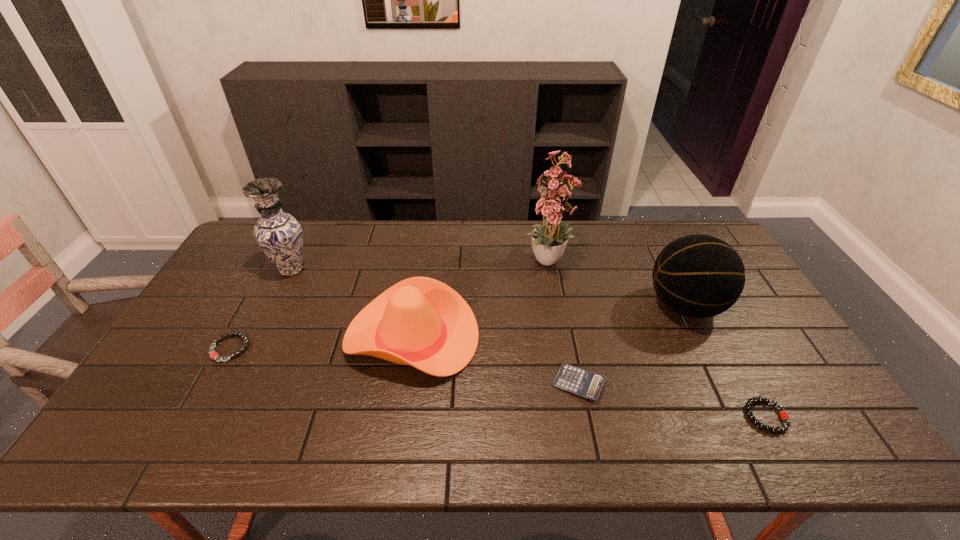
Identify the location of the tallest object. The width and height of the screenshot is (960, 540). tap(550, 199).

I want to click on vase, so click(279, 234).

Identify the location of the third tallest object. (699, 276).

This screenshot has height=540, width=960. I want to click on cowboy hat, so click(x=421, y=322).

Locate an element on the screen. the fourth shortest object is located at coordinates (421, 322).

The image size is (960, 540). Identify the location of calculator. (583, 383).

Locate an element on the screen. This screenshot has height=540, width=960. the left bracelet is located at coordinates (213, 355).

This screenshot has height=540, width=960. In order to click on the nearer bracelet in this screenshot , I will do `click(784, 415)`.

Where is `blank space located 0.100m on the front-facing side of the flower arrangement`? blank space located 0.100m on the front-facing side of the flower arrangement is located at coordinates (559, 312).

Locate an element on the screen. vacant space located on the right of the vase is located at coordinates (336, 270).